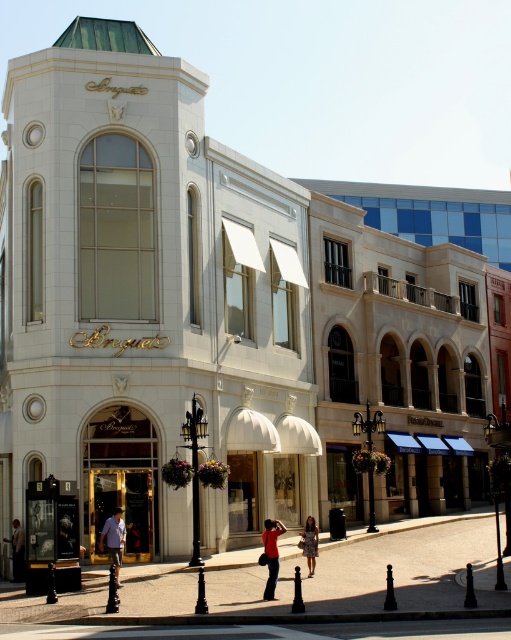
Question: Where is red fabric shirt at center located in relation to light brown leather jacket at lower left in the image?

Choices:
 (A) left
 (B) right

Answer: (B)

Question: Which object is closer to the camera taking this photo?

Choices:
 (A) light blue shirt at center
 (B) printed fabric dress at center
 (C) light brown leather jacket at lower left
 (D) red fabric shirt at center

Answer: (A)

Question: Does red fabric shirt at center lie behind light brown leather jacket at lower left?

Choices:
 (A) yes
 (B) no

Answer: (B)

Question: Which point appears closest to the camera in this image?

Choices:
 (A) (298, 544)
 (B) (107, 541)
 (C) (15, 524)

Answer: (B)

Question: Is red fabric shirt at center wider than light blue shirt at center?

Choices:
 (A) yes
 (B) no

Answer: (B)

Question: Among these objects, which one is farthest from the camera?

Choices:
 (A) red fabric shirt at center
 (B) printed fabric dress at center

Answer: (B)